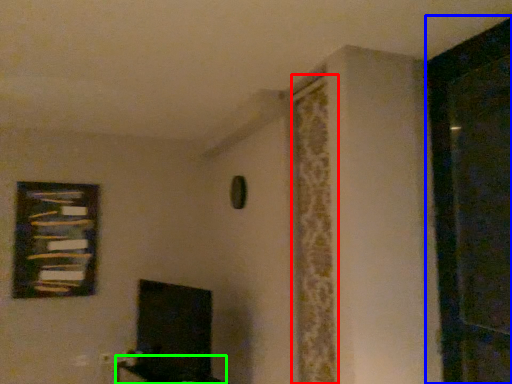
Question: Estimate the real-world distances between objects in this image. Which object is farther from curtain (highlighted by a red box), screen door (highlighted by a blue box) or furniture (highlighted by a green box)?

Choices:
 (A) screen door
 (B) furniture

Answer: (B)